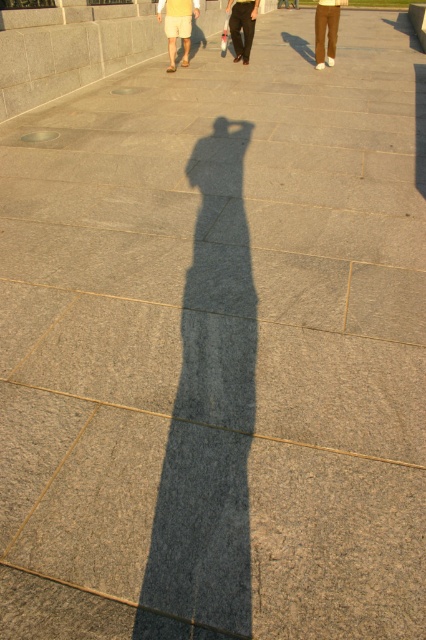
Does light yellow shorts at upper left have a smaller size compared to black smooth pants at center?

No.

Is point (170, 4) closer to viewer compared to point (236, 35)?

Yes, point (170, 4) is in front of point (236, 35).

Locate an element on the screen. Image resolution: width=426 pixels, height=640 pixels. light yellow shorts at upper left is located at coordinates (178, 26).

Does light yellow shorts at upper left appear on the right side of brown cotton pants at upper right?

Incorrect, light yellow shorts at upper left is not on the right side of brown cotton pants at upper right.

What do you see at coordinates (178, 26) in the screenshot?
I see `light yellow shorts at upper left` at bounding box center [178, 26].

Where is `light yellow shorts at upper left`? The image size is (426, 640). light yellow shorts at upper left is located at coordinates (178, 26).

Between brown cotton pants at upper right and black smooth pants at center, which one appears on the right side from the viewer's perspective?

From the viewer's perspective, brown cotton pants at upper right appears more on the right side.

What do you see at coordinates (328, 29) in the screenshot?
I see `brown cotton pants at upper right` at bounding box center [328, 29].

Who is more forward, (333,35) or (241,17)?

Point (241,17)

Identify the location of brown cotton pants at upper right. (328, 29).